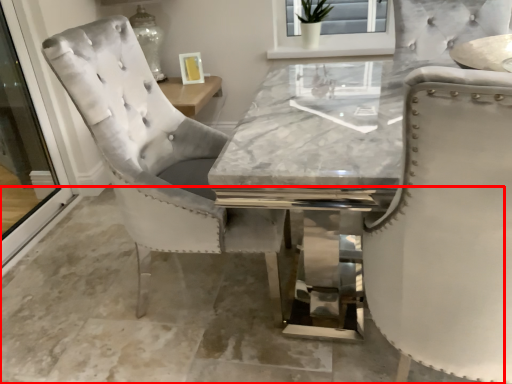
Question: Considering the relative positions of concrete (annotated by the red box) and screen door in the image provided, where is concrete (annotated by the red box) located with respect to the staircase?

Choices:
 (A) right
 (B) left

Answer: (A)